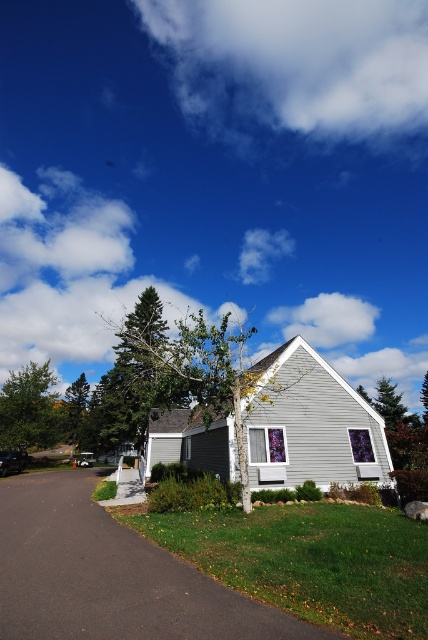
Question: Does dark asphalt driveway at lower left appear over green matte tree at upper left?

Choices:
 (A) no
 (B) yes

Answer: (B)

Question: Is green matte tree at upper left further to camera compared to green leafy tree at left?

Choices:
 (A) no
 (B) yes

Answer: (A)

Question: Which is nearer to the dark asphalt driveway at lower left?

Choices:
 (A) green matte tree at upper left
 (B) green leafy tree at left
 (C) green leafy tree at center

Answer: (A)

Question: Which object is positioned closest to the dark asphalt driveway at lower left?

Choices:
 (A) green leafy tree at left
 (B) green matte tree at upper left

Answer: (B)

Question: Which point is farther to the camera?

Choices:
 (A) (145, 404)
 (B) (35, 518)
 (C) (35, 445)

Answer: (C)

Question: Does green leafy tree at center have a smaller size compared to green leafy tree at left?

Choices:
 (A) no
 (B) yes

Answer: (B)